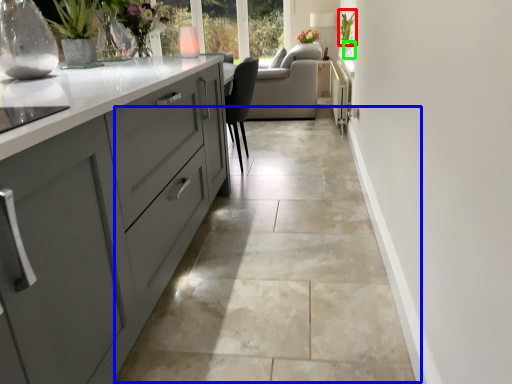
Question: Estimate the real-world distances between objects in this image. Which object is closer to plant (highlighted by a red box), concrete (highlighted by a blue box) or glass vase (highlighted by a green box)?

Choices:
 (A) concrete
 (B) glass vase

Answer: (B)